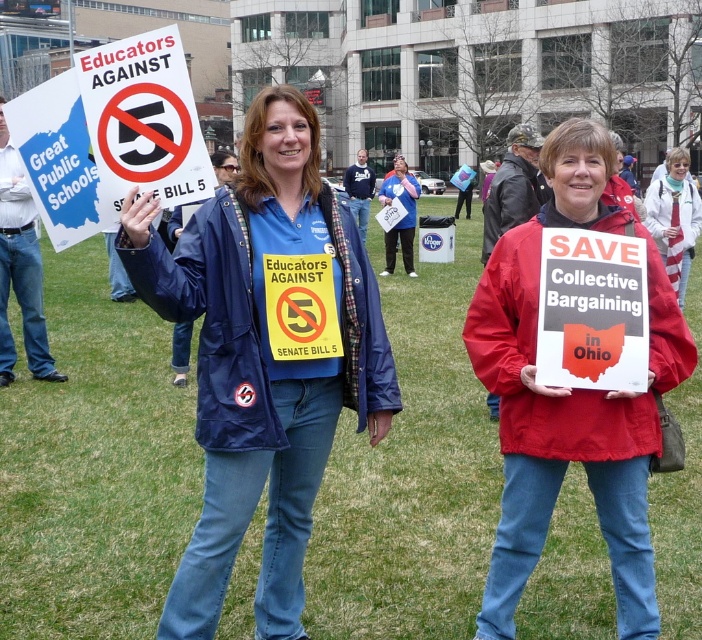
Based on the scene description, can you determine the position of the green grass at center relative to the blue fabric jacket at center?

The green grass at center is to the right of the blue fabric jacket at center.

You are a photographer trying to capture the two points in the image. Which point, point (125,584) or point (211,412), is closer to your camera lens?

Point (125,584) is further to the camera than point (211,412), so the point closer to the camera lens is point (211,412).

You are a journalist at the demonstration and need to capture the most visible sign for your article. Which sign should you choose between the white paper sign at upper left and the red paper sign at center?

The white paper sign at upper left has a larger size compared to the red paper sign at center, so it is more visible and should be chosen.